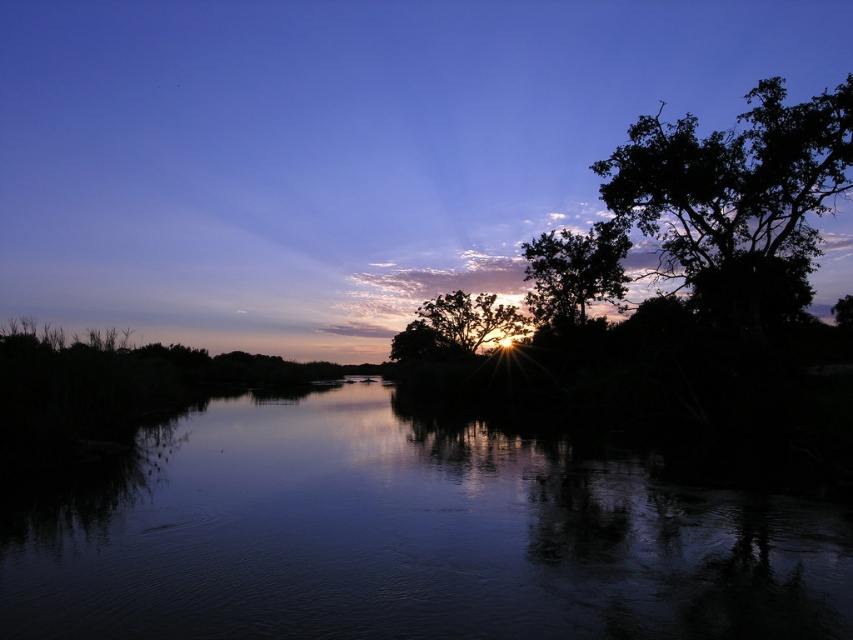
Question: Considering the real-world distances, which object is closest to the smooth water at center?

Choices:
 (A) green leafy tree at center
 (B) silhouette leafy tree at center

Answer: (A)

Question: Which of these objects is positioned farthest from the dark green leafy tree at upper right?

Choices:
 (A) silhouette leafy tree at center
 (B) smooth water at center
 (C) green leafy tree at center

Answer: (A)

Question: Is green leafy tree at center smaller than silhouette leafy tree at center?

Choices:
 (A) yes
 (B) no

Answer: (B)

Question: Can you confirm if dark green leafy tree at upper right is positioned below green leafy tree at center?

Choices:
 (A) no
 (B) yes

Answer: (A)

Question: Which point is closer to the camera?

Choices:
 (A) (839, 163)
 (B) (396, 333)
 (C) (273, 433)
 (D) (531, 301)

Answer: (C)

Question: From the image, what is the correct spatial relationship of smooth water at center in relation to silhouette leafy tree at center?

Choices:
 (A) left
 (B) right

Answer: (A)